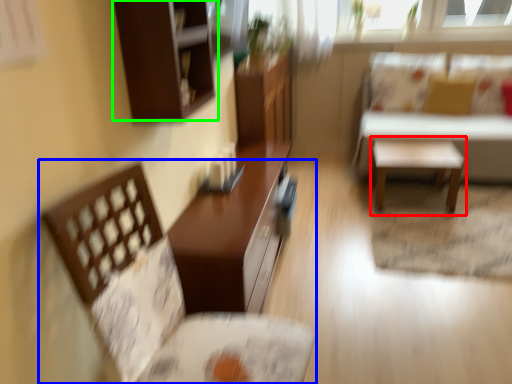
Question: Which object is the farthest from side table (highlighted by a red box)? Choose among these: chair (highlighted by a blue box) or cabinetry (highlighted by a green box).

Choices:
 (A) chair
 (B) cabinetry

Answer: (A)